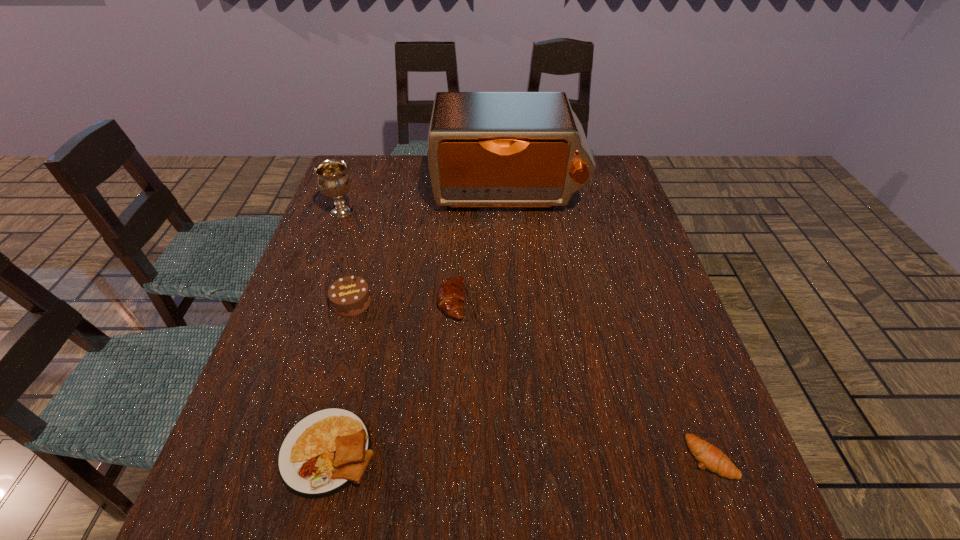
Locate an element on the screen. unoccupied area between the toaster oven and the third shortest object is located at coordinates (480, 247).

At what (x,y) coordinates should I click in order to perform the action: click on vacant space in between the nearer crescent roll and the farther crescent roll. Please return your answer as a coordinate pair (x, y). Image resolution: width=960 pixels, height=540 pixels. Looking at the image, I should click on (581, 379).

Locate an element on the screen. Image resolution: width=960 pixels, height=540 pixels. free spot between the farther crescent roll and the right crescent roll is located at coordinates (581, 379).

The image size is (960, 540). In order to click on vacant space that is in between the fourth shortest object and the toaster oven in this screenshot , I will do `click(430, 248)`.

The image size is (960, 540). I want to click on vacant area that lies between the second tallest object and the toaster oven, so click(424, 202).

I want to click on vacant space that is in between the rightmost object and the chalice, so click(x=526, y=334).

Find the location of a particular element. free space between the chalice and the fourth tallest object is located at coordinates (396, 256).

I want to click on vacant area that lies between the right crescent roll and the toaster oven, so click(610, 326).

What are the coordinates of `object that can be found as the fourth closest to the toaster oven` in the screenshot? It's located at (322, 454).

Identify which object is the fourth closest to the nearer crescent roll. Please provide its 2D coordinates. Your answer should be formatted as a tuple, i.e. [(x, y)], where the tuple contains the x and y coordinates of a point satisfying the conditions above.

[(349, 296)]